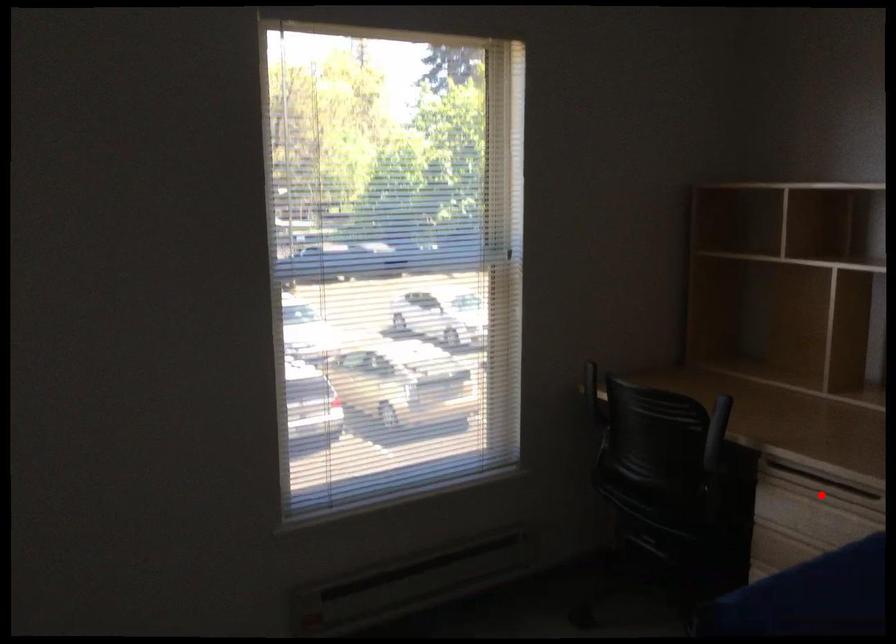
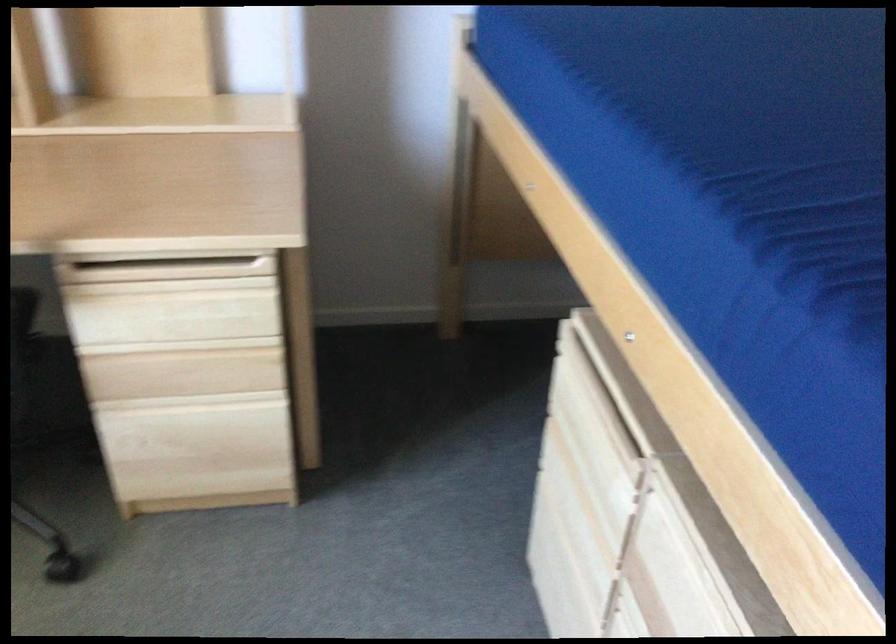
The point at the highlighted location is marked in the first image. Where is the corresponding point in the second image?

(166, 270)